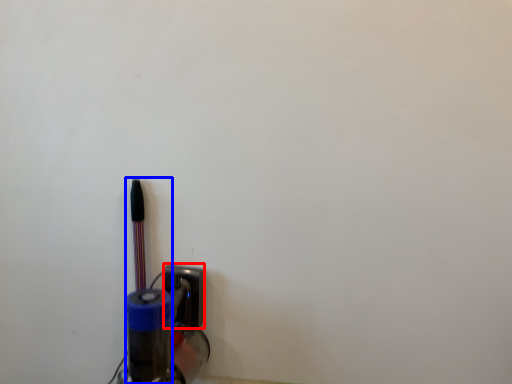
Question: Among these objects, which one is nearest to the camera, socket (highlighted by a red box) or penguin (highlighted by a blue box)?

Choices:
 (A) socket
 (B) penguin

Answer: (B)